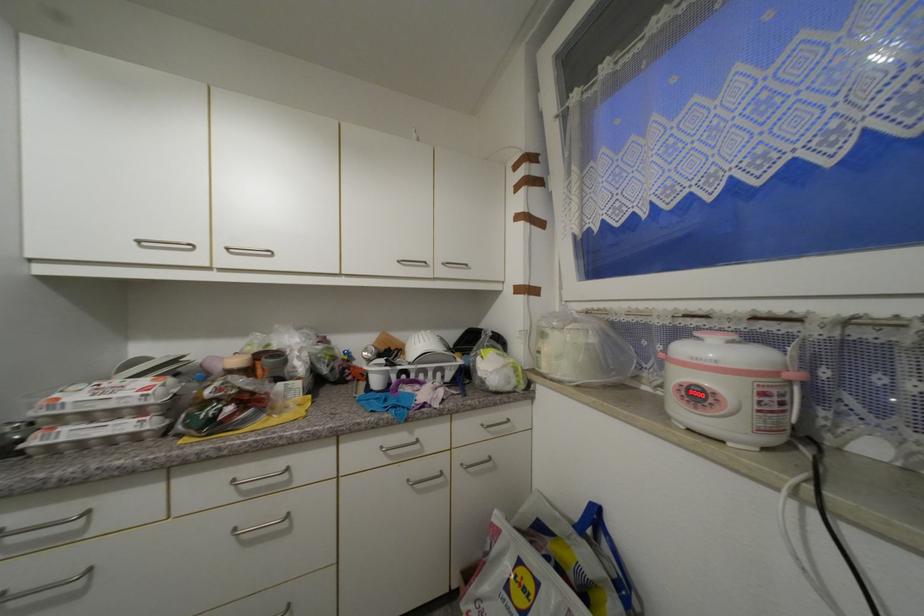
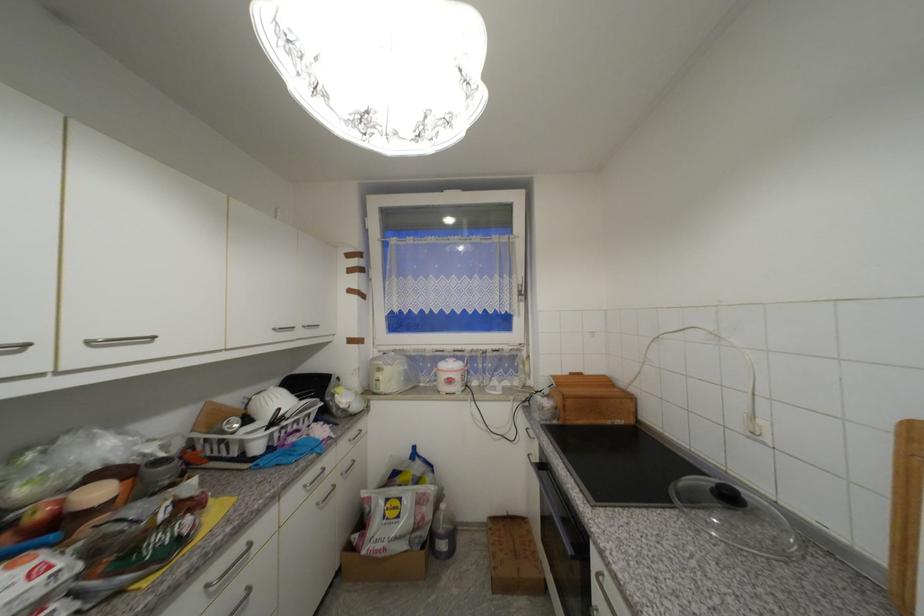
Locate, in the second image, the point that corresponds to pixel 415 483 in the first image.

(322, 505)